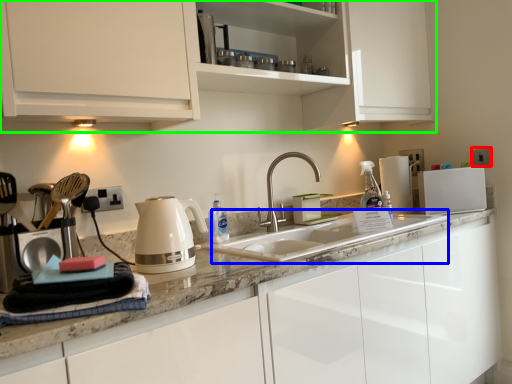
Question: Estimate the real-world distances between objects in this image. Which object is farther from electric outlet (highlighted by a red box), sink (highlighted by a blue box) or cabinetry (highlighted by a green box)?

Choices:
 (A) sink
 (B) cabinetry

Answer: (B)